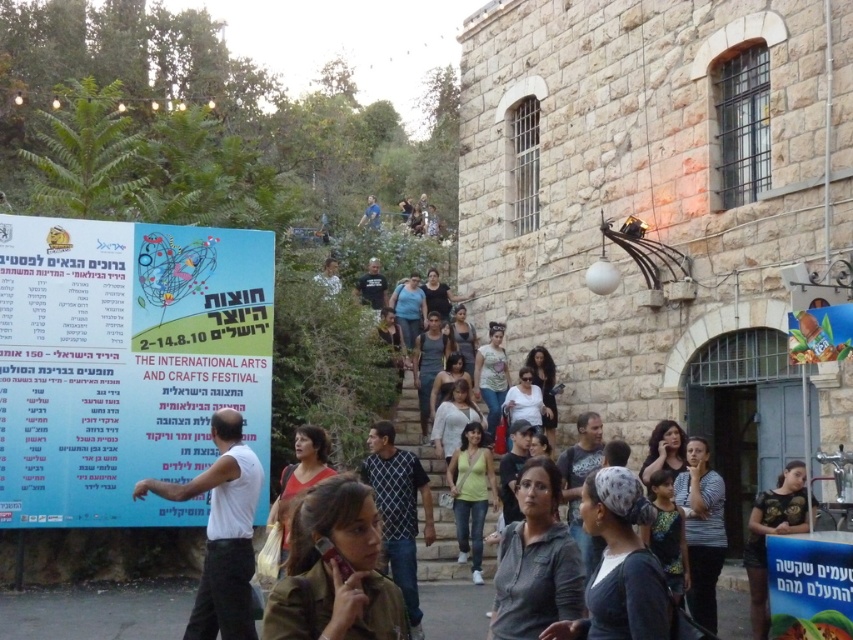
You are at the International Arts and Crafts Festival and want to take a photo of the large blue sign on the left side of the frame. You are currently standing at point (576, 609). If you move towards point (305, 451), will you get closer to the sign?

Yes, because point (576, 609) is in front of point (305, 451). Moving towards point (305, 451) would mean moving backward away from the sign, so you would actually get farther away. Wait, this seems contradictory. Let me think again. If point A is in front of point B, then moving from A towards B would mean moving backward, away from the sign. Therefore, the answer should be no. Hmm, maybe I need to clarify the spatial relationship. Alternatively, perhaps the question should be phrased to ask if the v